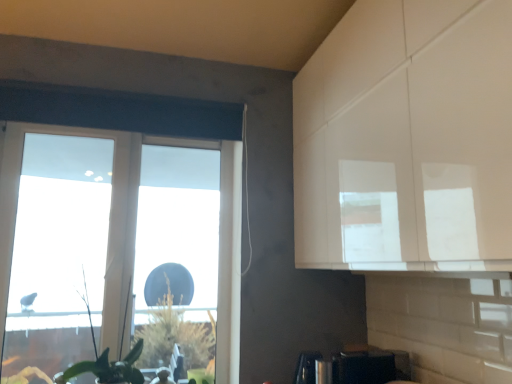
Question: In the image, is satin black toaster at lower center positioned in front of or behind transparent plastic window at left?

Choices:
 (A) front
 (B) behind

Answer: (A)

Question: Considering the relative positions of satin black toaster at lower center and transparent plastic window at left in the image provided, is satin black toaster at lower center to the left or to the right of transparent plastic window at left?

Choices:
 (A) left
 (B) right

Answer: (B)

Question: Based on their relative distances, which object is nearer to the satin black toaster at lower center?

Choices:
 (A) transparent plastic window at left
 (B) green leafy plant at lower left

Answer: (B)

Question: Which object is the farthest from the satin black toaster at lower center?

Choices:
 (A) green leafy plant at lower left
 (B) transparent plastic window at left

Answer: (B)